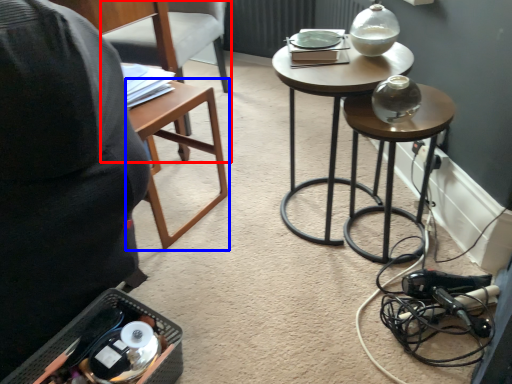
Question: Among these objects, which one is nearest to the camera, chair (highlighted by a red box) or table (highlighted by a blue box)?

Choices:
 (A) chair
 (B) table

Answer: (B)